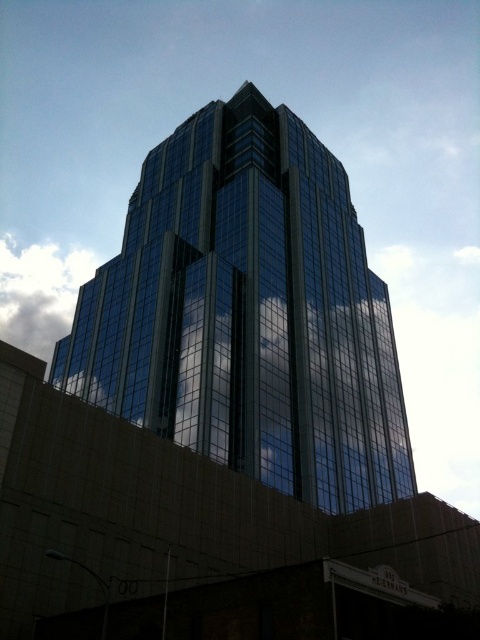
Question: Which object is farther from the camera taking this photo?

Choices:
 (A) white fluffy cloud at upper left
 (B) glossy glass building at center

Answer: (A)

Question: Which of the following is the closest to the observer?

Choices:
 (A) glossy glass building at center
 (B) white fluffy cloud at upper left

Answer: (A)

Question: Is glossy glass building at center positioned behind white fluffy cloud at upper left?

Choices:
 (A) no
 (B) yes

Answer: (A)

Question: Is glossy glass building at center above white fluffy cloud at upper left?

Choices:
 (A) no
 (B) yes

Answer: (A)

Question: Observing the image, what is the correct spatial positioning of glossy glass building at center in reference to white fluffy cloud at upper left?

Choices:
 (A) below
 (B) above

Answer: (A)